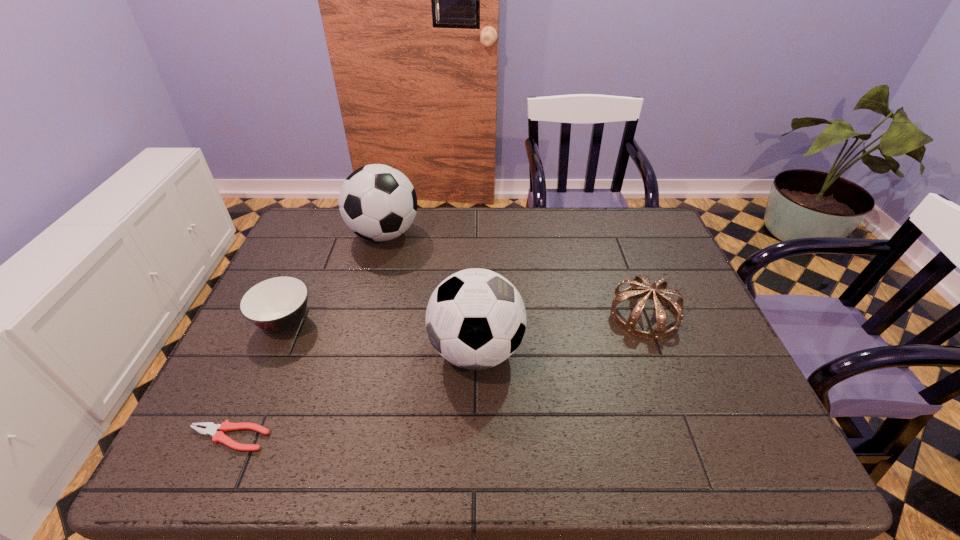
The height and width of the screenshot is (540, 960). I want to click on the farthest object, so click(x=377, y=202).

Identify the location of the left soccer ball. (377, 202).

Find the location of `the nearer soccer ball`. the nearer soccer ball is located at coordinates (475, 319).

What are the coordinates of `the fourth object from left to right` in the screenshot? It's located at (475, 319).

You are a GUI agent. You are given a task and a screenshot of the screen. Output one action in this format:
    pyautogui.click(x=<x>, y=<y>)
    Task: Click on the tiara
    
    Given the screenshot: What is the action you would take?
    pyautogui.click(x=636, y=287)

You are a GUI agent. You are given a task and a screenshot of the screen. Output one action in this format:
    pyautogui.click(x=<x>, y=<y>)
    Task: Click on the third tallest object
    
    Given the screenshot: What is the action you would take?
    pyautogui.click(x=636, y=287)

This screenshot has width=960, height=540. I want to click on the fourth tallest object, so click(x=277, y=304).

Find the location of a particular element. The image size is (960, 540). pliers is located at coordinates (211, 429).

The image size is (960, 540). I want to click on the nearest object, so click(x=211, y=429).

In order to click on vacant space located on the front of the farthest object in this screenshot , I will do `click(356, 340)`.